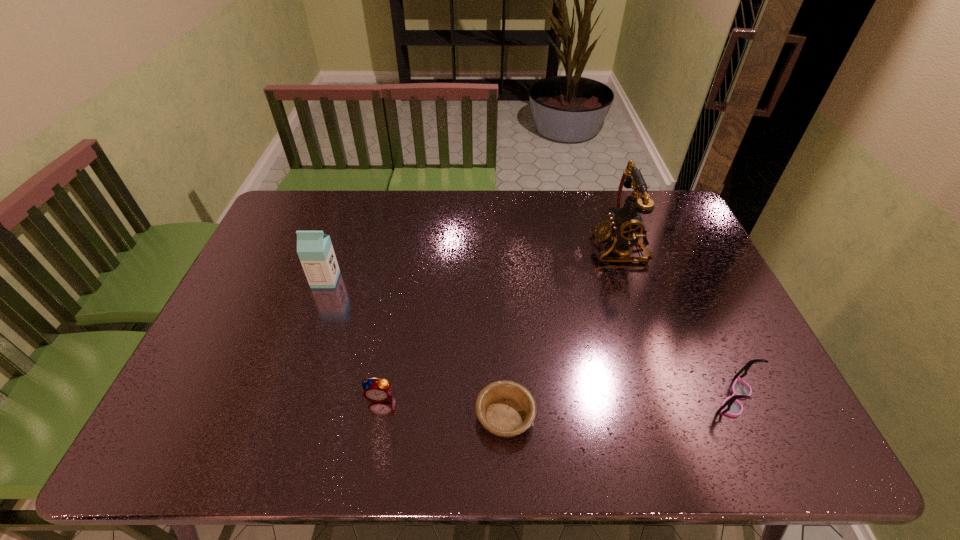
I want to click on free spot located 0.290m on the front of the second object from right to left, featuring the rotary dial, so click(x=504, y=247).

The image size is (960, 540). I want to click on vacant region located 0.130m on the front of the second object from right to left, featuring the rotary dial, so click(x=553, y=247).

The height and width of the screenshot is (540, 960). Identify the location of free space located 0.350m on the front of the milk carton. (286, 393).

Identify the location of vacant space located 0.140m on the left of the spectacles. The width and height of the screenshot is (960, 540). (653, 399).

In order to click on vacant space located on the front-facing side of the alarm clock in this screenshot , I will do `click(373, 431)`.

Where is `vacant space located 0.270m on the right of the third object from right to left`? Image resolution: width=960 pixels, height=540 pixels. vacant space located 0.270m on the right of the third object from right to left is located at coordinates coord(652,416).

Find the location of a particular element. The image size is (960, 540). object located at the far edge is located at coordinates (625, 226).

This screenshot has height=540, width=960. Find the location of `spectacles that is at the near edge`. spectacles that is at the near edge is located at coordinates (731, 406).

At what (x,y) coordinates should I click in order to perform the action: click on bowl that is at the near edge. Please return your answer as a coordinate pair (x, y). Looking at the image, I should click on (505, 408).

In order to click on object that is at the right edge in this screenshot , I will do `click(731, 406)`.